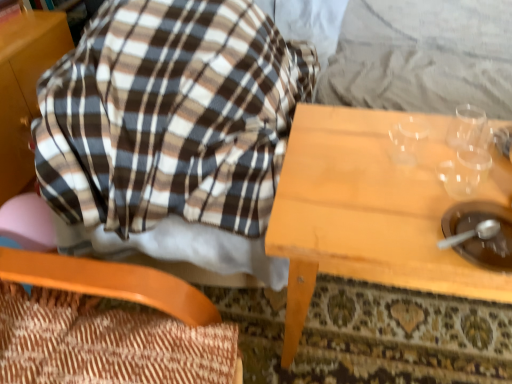
Identify the location of vacant area to the left of brown matte bowl at lower right. (395, 224).